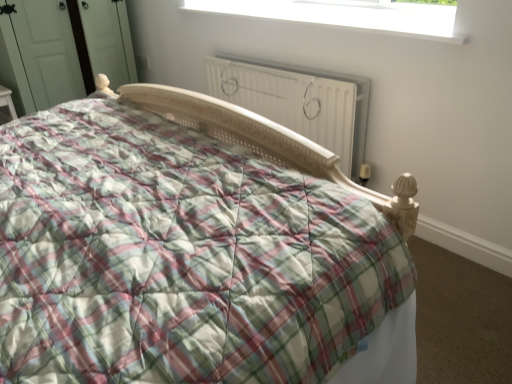
Question: From the image's perspective, would you say white plastic window at upper center is positioned over plaid fabric bed at center?

Choices:
 (A) yes
 (B) no

Answer: (A)

Question: Is white plastic window at upper center bigger than plaid fabric bed at center?

Choices:
 (A) no
 (B) yes

Answer: (A)

Question: Is the depth of white plastic window at upper center less than that of plaid fabric bed at center?

Choices:
 (A) yes
 (B) no

Answer: (B)

Question: Considering the relative sizes of white plastic window at upper center and plaid fabric bed at center in the image provided, is white plastic window at upper center taller than plaid fabric bed at center?

Choices:
 (A) yes
 (B) no

Answer: (B)

Question: From a real-world perspective, is white plastic window at upper center positioned under plaid fabric bed at center based on gravity?

Choices:
 (A) yes
 (B) no

Answer: (B)

Question: Is white plastic window at upper center further to camera compared to plaid fabric bed at center?

Choices:
 (A) yes
 (B) no

Answer: (A)

Question: From a real-world perspective, is white matte radiator at center located beneath white plastic window at upper center?

Choices:
 (A) yes
 (B) no

Answer: (A)

Question: From the image's perspective, is white matte radiator at center on white plastic window at upper center?

Choices:
 (A) yes
 (B) no

Answer: (B)

Question: Can you confirm if white matte radiator at center is shorter than white plastic window at upper center?

Choices:
 (A) yes
 (B) no

Answer: (B)

Question: Can you confirm if white matte radiator at center is wider than white plastic window at upper center?

Choices:
 (A) no
 (B) yes

Answer: (A)

Question: Is white matte radiator at center oriented away from white plastic window at upper center?

Choices:
 (A) no
 (B) yes

Answer: (A)

Question: Is white matte radiator at center next to white plastic window at upper center?

Choices:
 (A) yes
 (B) no

Answer: (B)

Question: From a real-world perspective, does plaid fabric bed at center stand above white plastic window at upper center?

Choices:
 (A) no
 (B) yes

Answer: (A)